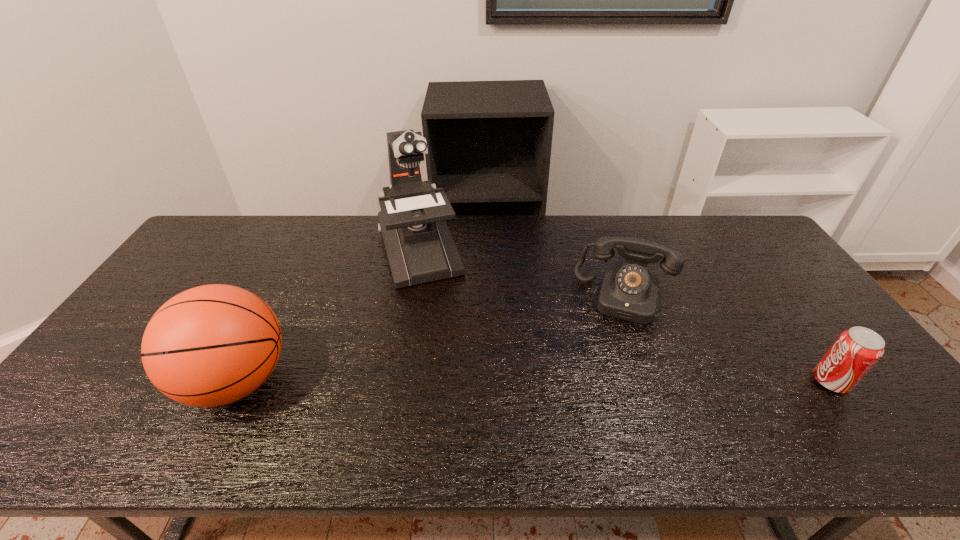
You are a GUI agent. You are given a task and a screenshot of the screen. Output one action in this format:
    pyautogui.click(x=<x>, y=<y>)
    Task: Click on the blank space that satisfies the following two spatial constraints: 1. on the front side of the soda can; 2. on the logo side of the third object from left to right
    The width and height of the screenshot is (960, 540).
    Given the screenshot: What is the action you would take?
    pyautogui.click(x=656, y=381)